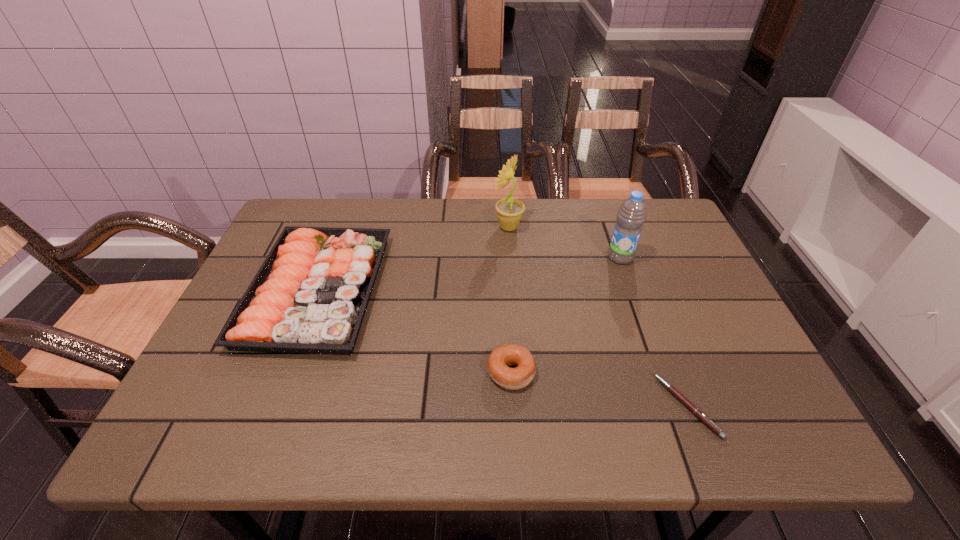
Locate an element on the screen. This screenshot has height=540, width=960. object that is at the far left corner is located at coordinates (310, 295).

This screenshot has height=540, width=960. I want to click on object that is at the near right corner, so click(697, 412).

You are a GUI agent. You are given a task and a screenshot of the screen. Output one action in this format:
    pyautogui.click(x=<x>, y=<y>)
    Task: Click on the vacant space at the far edge
    
    Given the screenshot: What is the action you would take?
    pyautogui.click(x=390, y=234)

In the image, there is a desktop. Identify the location of vacant space at the near edge. (479, 409).

This screenshot has width=960, height=540. In the image, there is a desktop. Find the location of `free space at the left edge`. free space at the left edge is located at coordinates (246, 386).

Where is `free region at the near left corner`? free region at the near left corner is located at coordinates (236, 440).

In the image, there is a desktop. Identify the location of vacant space at the far right corner. (666, 239).

At what (x,y) coordinates should I click in order to perform the action: click on vacant region at the near right corner of the desktop. Please return your answer as a coordinate pair (x, y). The width and height of the screenshot is (960, 540). Looking at the image, I should click on (743, 440).

Where is `free space between the leftmost object and the sunflower`? free space between the leftmost object and the sunflower is located at coordinates (413, 259).

Where is `vacant area that lies between the water bottle and the bagel`? This screenshot has height=540, width=960. vacant area that lies between the water bottle and the bagel is located at coordinates (565, 315).